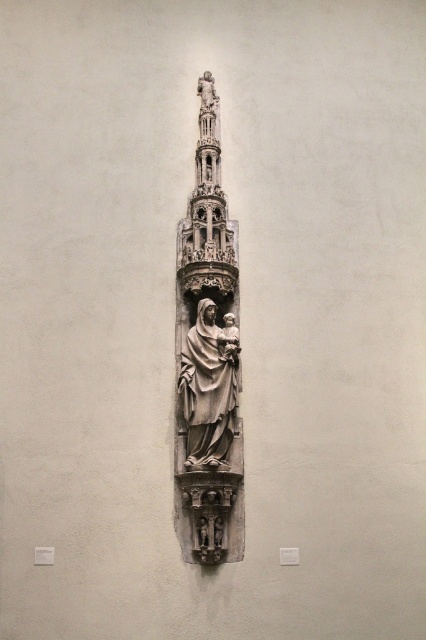
Consider the image. You are an art conservator examining the vertical stone sculpture on the wall. You notice two statues at the center. Which one is larger in size between the stone statue at center and the matte gray statue at center?

The stone statue at center is bigger than the matte gray statue at center.

You are standing in front of the vertical stone sculpture. There is a point at coordinates point (209, 433). Can you determine if this point is closer to you than 40 meters?

The distance of point (209, 433) from viewer is 37.01 meters, so yes, it is closer than 40 meters.